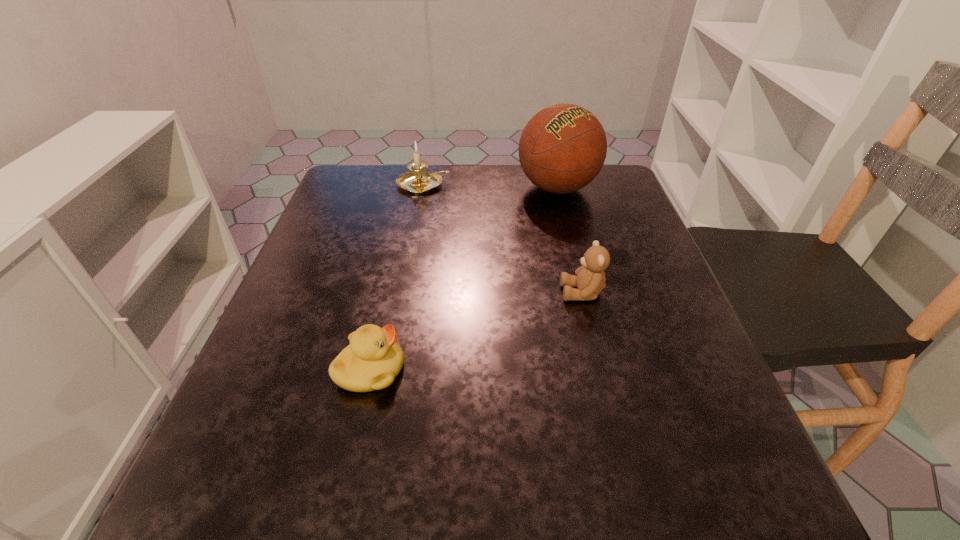
Locate an element on the screen. empty space between the second nearest object and the candle holder is located at coordinates (503, 239).

The image size is (960, 540). In order to click on free space between the nearest object and the second nearest object in this screenshot , I will do `click(476, 331)`.

The height and width of the screenshot is (540, 960). I want to click on free spot between the candle holder and the basketball, so click(491, 186).

At what (x,y) coordinates should I click in order to perform the action: click on free space that is in between the candle holder and the tallest object. Please return your answer as a coordinate pair (x, y). Image resolution: width=960 pixels, height=540 pixels. Looking at the image, I should click on (491, 186).

At what (x,y) coordinates should I click in order to perform the action: click on empty space that is in between the basketball and the teddy bear. Please return your answer as a coordinate pair (x, y). This screenshot has width=960, height=540. Looking at the image, I should click on (569, 240).

I want to click on object that can be found as the closest to the shortest object, so click(590, 280).

In order to click on the third closest object to the candle holder in this screenshot , I will do `click(372, 360)`.

Identify the location of free location that satisfies the following two spatial constraints: 1. on the front side of the tallest object; 2. on the beak of the duckling. (603, 370).

You are a GUI agent. You are given a task and a screenshot of the screen. Output one action in this format:
    pyautogui.click(x=<x>, y=<y>)
    Task: Click on the vacant space that satisfies the following two spatial constraints: 1. on the handle side of the tallest object; 2. on the right side of the candle holder
    
    Given the screenshot: What is the action you would take?
    pyautogui.click(x=422, y=188)

Identify the location of vacant space that satisfies the following two spatial constraints: 1. on the handle side of the candle holder; 2. on the right side of the tallest object. (422, 188).